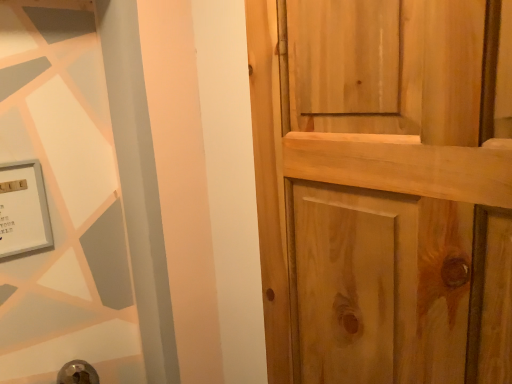
Image resolution: width=512 pixels, height=384 pixels. What do you see at coordinates (23, 209) in the screenshot?
I see `matte white frame at left` at bounding box center [23, 209].

Identify the location of matte white frame at left. The height and width of the screenshot is (384, 512). (23, 209).

At what (x,y) coordinates should I click in order to perform the action: click on matte white frame at left. Please return your answer as a coordinate pair (x, y). Image resolution: width=512 pixels, height=384 pixels. Looking at the image, I should click on tap(23, 209).